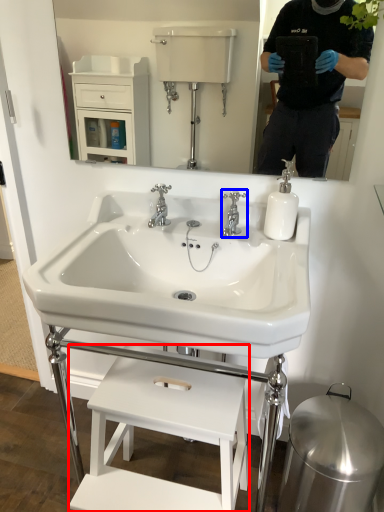
Question: Among these objects, which one is nearest to the camera, furniture (highlighted by a red box) or tap (highlighted by a blue box)?

Choices:
 (A) furniture
 (B) tap

Answer: (A)